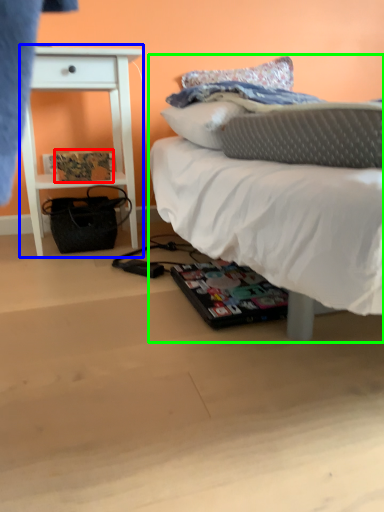
Question: Which object is the farthest from magazine (highlighted by a red box)? Choose among these: nightstand (highlighted by a blue box) or bed (highlighted by a green box).

Choices:
 (A) nightstand
 (B) bed

Answer: (B)